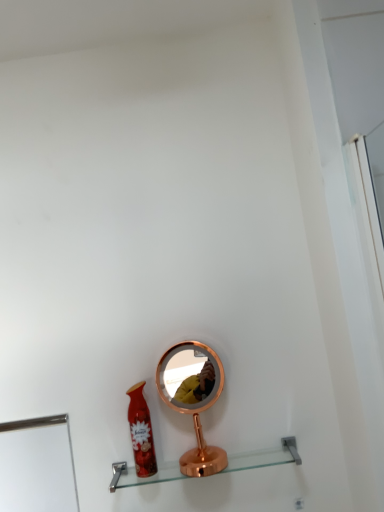
Question: Is clear glass shelf at center wider or thinner than matte red spray can at lower center?

Choices:
 (A) thin
 (B) wide

Answer: (B)

Question: From the image's perspective, is clear glass shelf at center positioned above or below matte red spray can at lower center?

Choices:
 (A) above
 (B) below

Answer: (B)

Question: Which is nearer to the copper metallic mirror at center?

Choices:
 (A) matte red spray can at lower center
 (B) clear glass shelf at center

Answer: (A)

Question: Which object is the farthest from the matte red spray can at lower center?

Choices:
 (A) copper metallic mirror at center
 (B) clear glass shelf at center

Answer: (B)